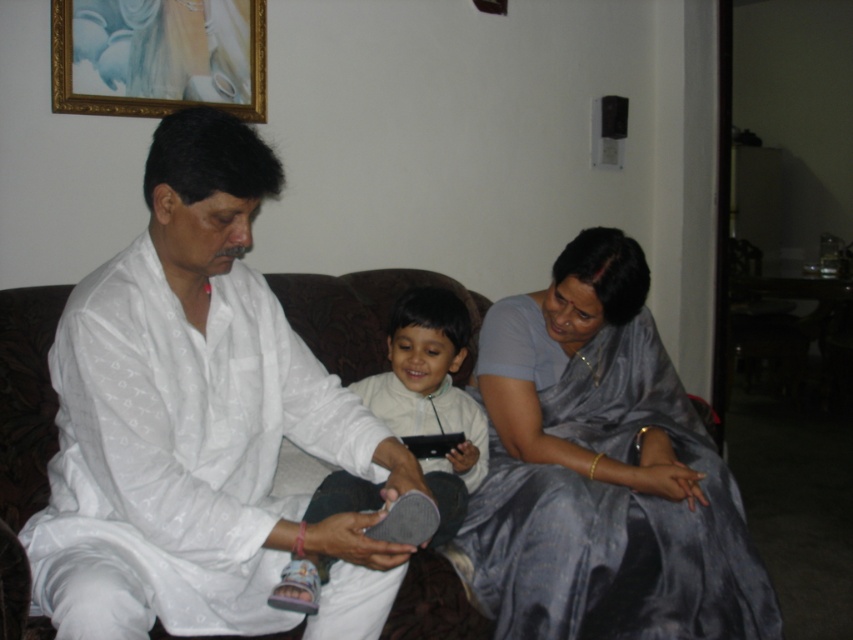
Question: Considering the real-world distances, which object is closest to the white matte sandal at center?

Choices:
 (A) silky blue saree at lower right
 (B) white cotton kurta at center

Answer: (A)

Question: Which object appears farthest from the camera in this image?

Choices:
 (A) white cotton kurta at center
 (B) silky blue saree at lower right
 (C) white matte sandal at center

Answer: (B)

Question: Estimate the real-world distances between objects in this image. Which object is closer to the silky blue saree at lower right?

Choices:
 (A) white cotton kurta at center
 (B) white matte sandal at center

Answer: (B)

Question: Does white cotton kurta at center have a larger size compared to silky blue saree at lower right?

Choices:
 (A) yes
 (B) no

Answer: (B)

Question: Does silky blue saree at lower right come in front of white matte sandal at center?

Choices:
 (A) yes
 (B) no

Answer: (B)

Question: Is silky blue saree at lower right smaller than white matte sandal at center?

Choices:
 (A) yes
 (B) no

Answer: (B)